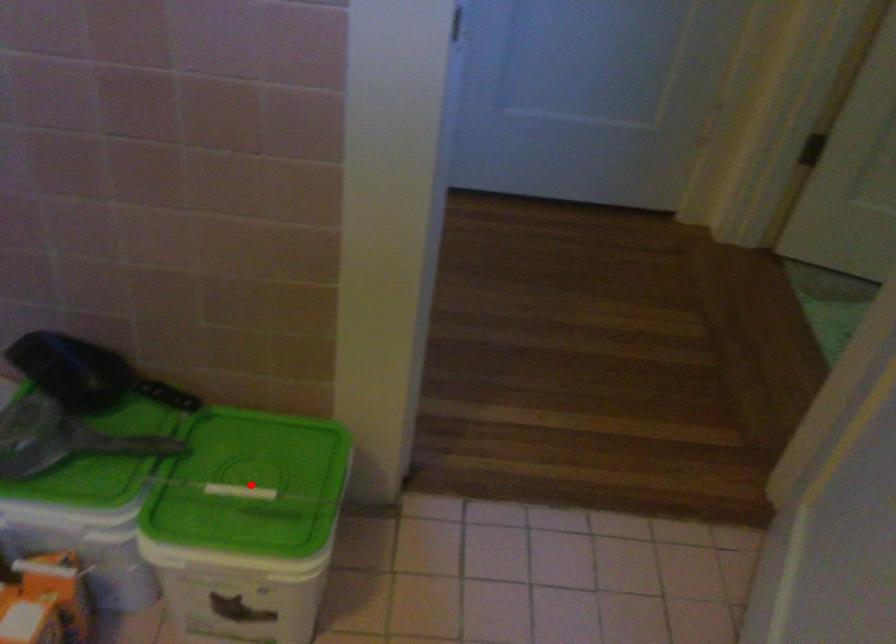
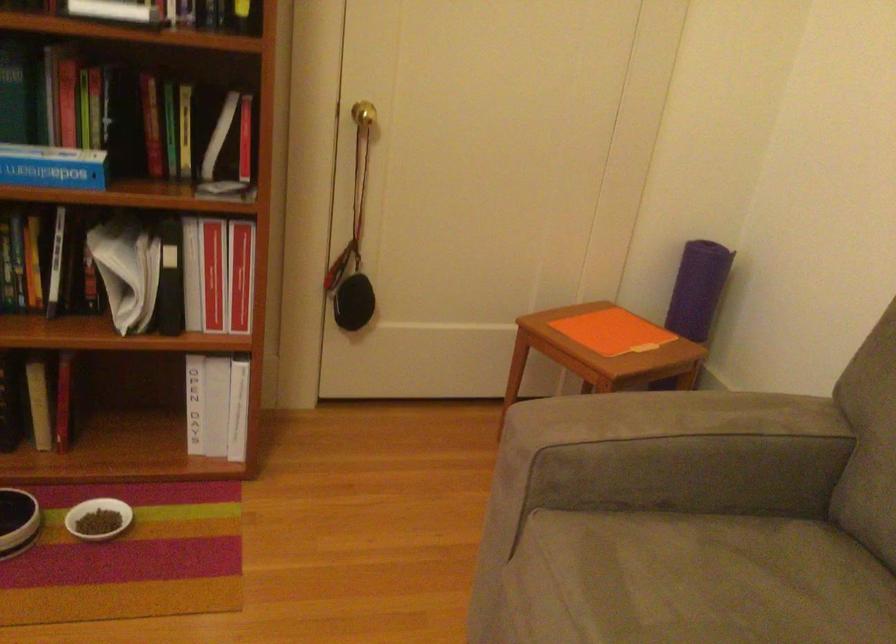
Question: I am providing you with two images of the same scene from different viewpoints. A red point is marked on the first image. At the location where the point appears in image 1, is it still visible in image 2?

Choices:
 (A) Yes
 (B) No

Answer: (B)